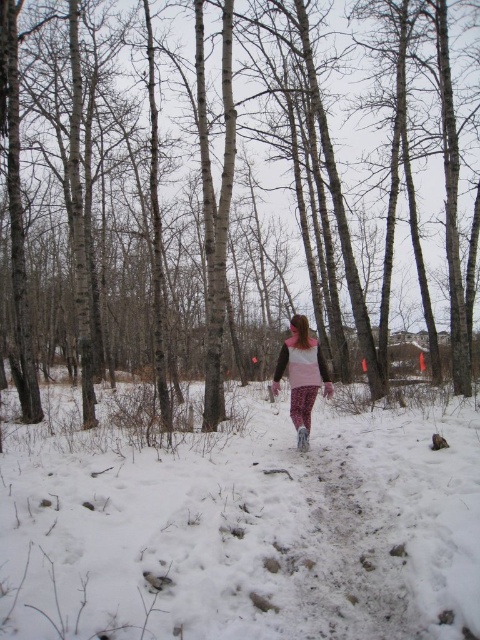
Question: Is brown smooth tree at center thinner than pink fleece jacket at center?

Choices:
 (A) no
 (B) yes

Answer: (A)

Question: Which point is farther to the camera?

Choices:
 (A) brown smooth tree at center
 (B) white powdery snow at center
 (C) pink fleece jacket at center

Answer: (C)

Question: Which object appears closest to the camera in this image?

Choices:
 (A) pink fleece jacket at center
 (B) brown smooth tree at center
 (C) white powdery snow at center

Answer: (C)

Question: From the image, what is the correct spatial relationship of brown smooth tree at center in relation to pink fleece jacket at center?

Choices:
 (A) above
 (B) below

Answer: (A)

Question: Which point is closer to the camera taking this photo?

Choices:
 (A) (84, 115)
 (B) (156, 604)

Answer: (B)

Question: Where is brown smooth tree at center located in relation to white powdery snow at center in the image?

Choices:
 (A) below
 (B) above

Answer: (B)